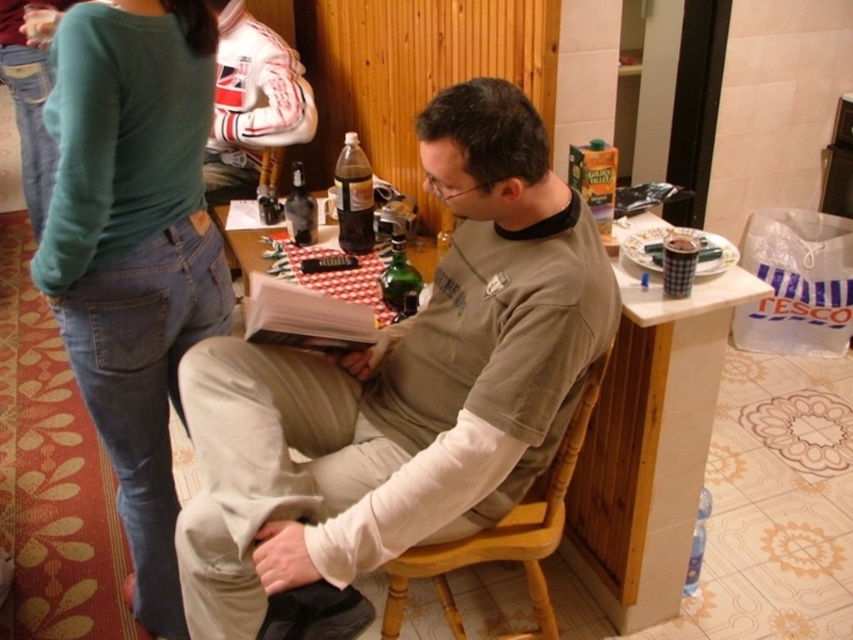
What are the coordinates of the matte gray shirt at center?

The matte gray shirt at center is located at point (402, 385).

You are a delivery person who needs to place a small package between the matte gray shirt at center and the green cotton sweater at upper left. The package requires 18 inches of space. Can you fit it there?

The matte gray shirt at center is 18.23 inches away from the green cotton sweater at upper left, so yes, the package can fit between them since the distance is sufficient.

You are a tailor measuring the width of clothing items in the scene. You need to determine if the matte gray shirt at center can fit into a storage box that can only accommodate items narrower than the green glass bottle at center. Can it fit?

The matte gray shirt at center is wider than the green glass bottle at center, so it cannot fit into the storage box designed for items narrower than the green glass bottle at center.